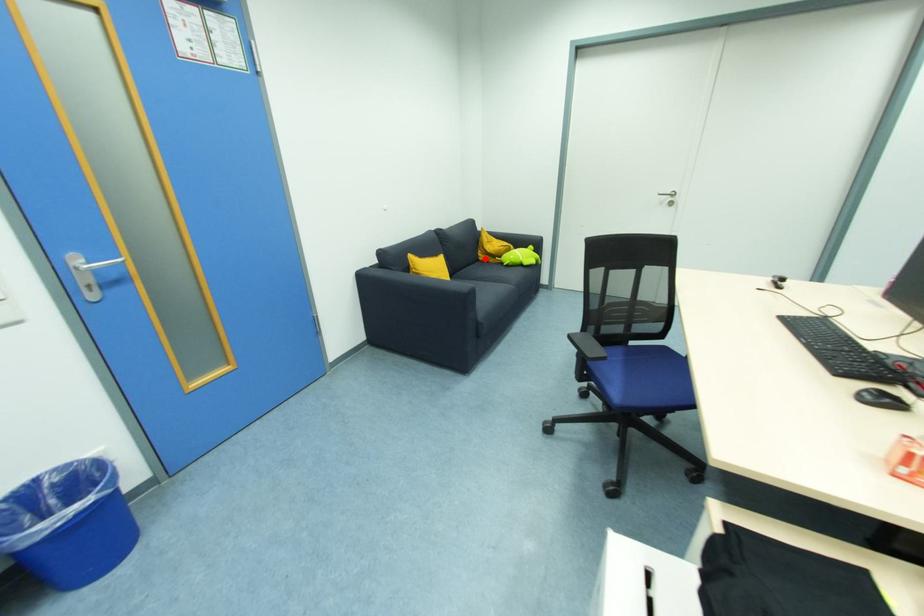
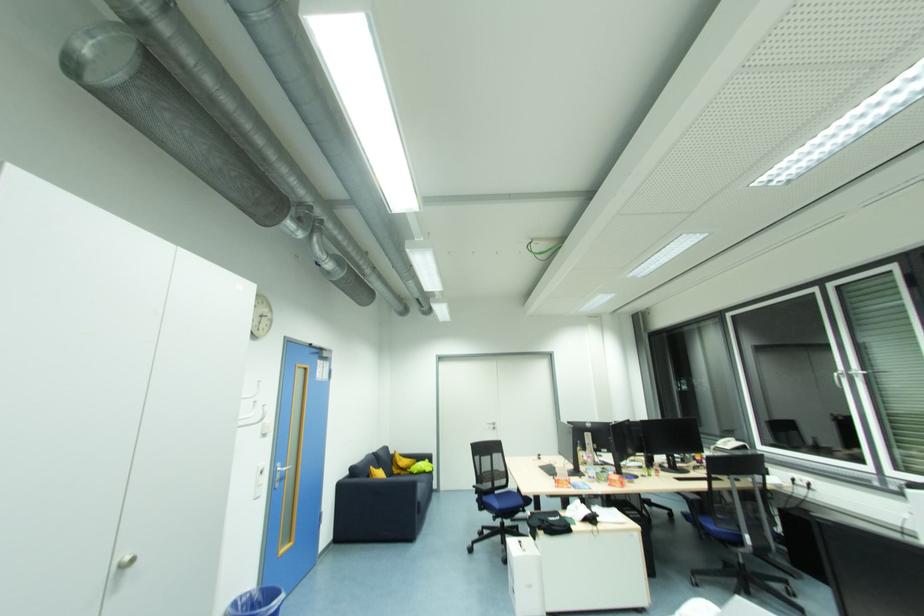
The point at the highlighted location is marked in the first image. Where is the corresponding point in the second image?

(398, 472)